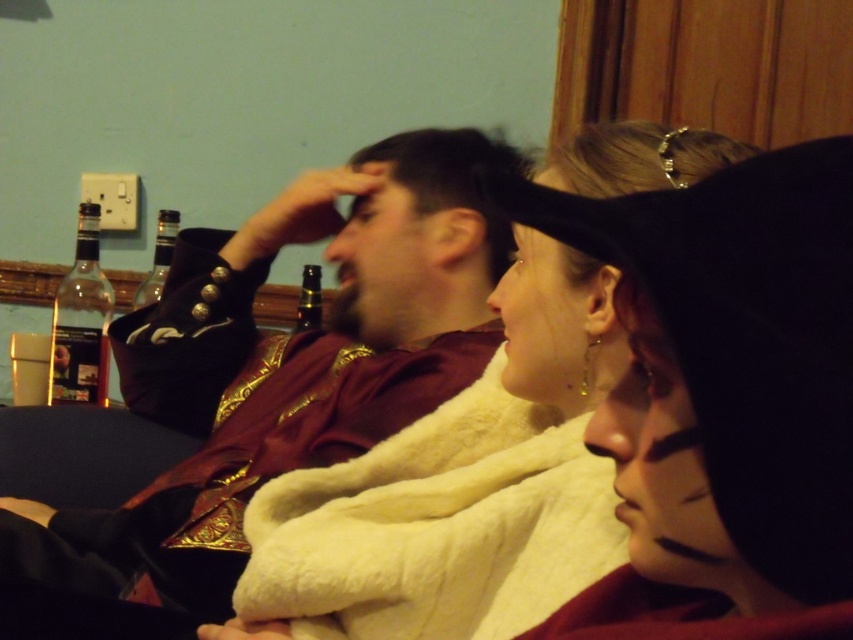
You are a photographer trying to capture a portrait of the matte brown hair at center and the black felt hat at upper center. Which object should you focus on first if you want to ensure both are in focus, given that your camera can only focus on one subject at a time?

The matte brown hair at center is taller than the black felt hat at upper center, so focusing on the matte brown hair at center first would ensure both are in focus since it is closer to the camera.

You are a photographer setting up a camera to capture the scene. The matte brown hair at center and the black felt hat at upper center are in your viewfinder. Which object is positioned higher in the frame?

The matte brown hair at center is above the black felt hat at upper center, so the matte brown hair at center is positioned higher in the frame.

You are a photographer setting up for a group photo. You need to ensure that the matte brown hair at center and the black felt hat at upper center are at least 16 inches apart to avoid overlapping in the frame. Based on the scene description, will their current positions meet this requirement?

The matte brown hair at center and black felt hat at upper center are currently 15.05 inches apart, which is less than the required 16 inches. Therefore, their current positions will not meet the requirement, and adjustments are needed to increase the distance between them.